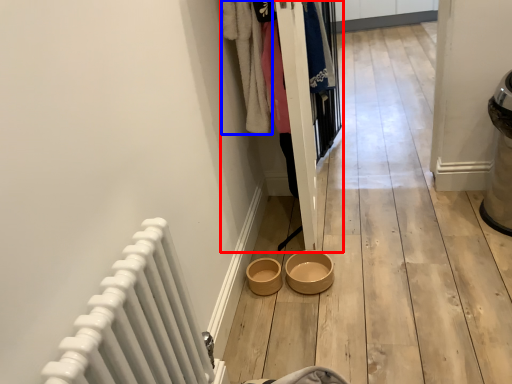
Question: Which of the following is the closest to the observer, closet (highlighted by a red box) or clothing (highlighted by a blue box)?

Choices:
 (A) closet
 (B) clothing

Answer: (A)